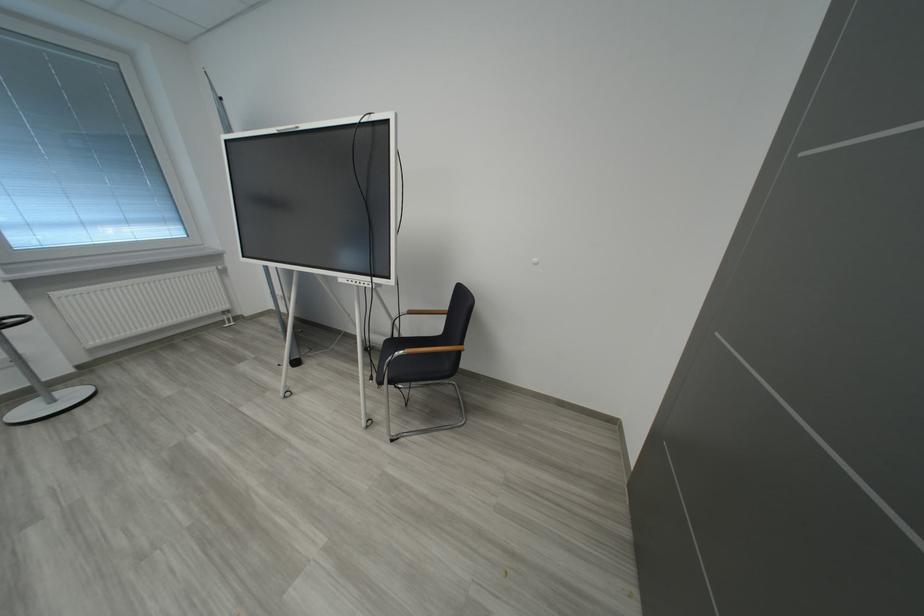
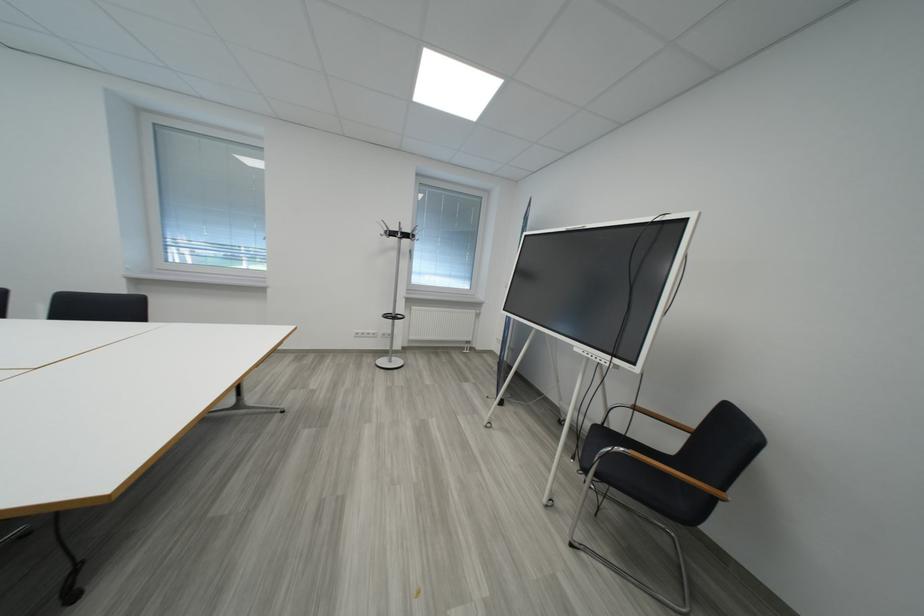
Question: The first image is from the beginning of the video and the second image is from the end. How did the camera likely rotate when shooting the video?

Choices:
 (A) Left
 (B) Right
 (C) Up
 (D) Down

Answer: (A)